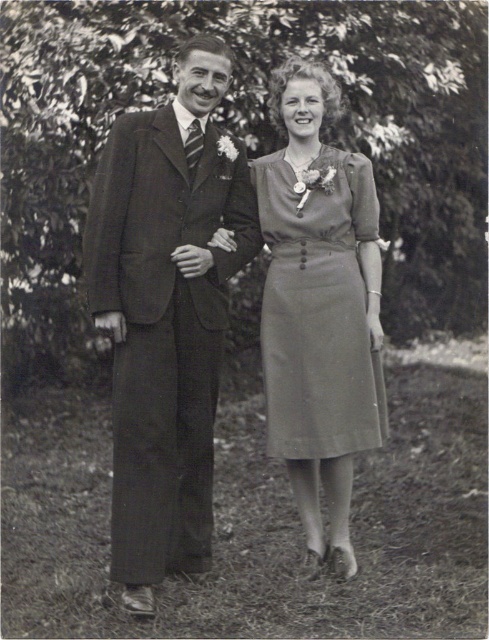
You are a photographer setting up for a group photo. You need to ensure that the matte dark suit at left and the matte gray dress at center are both in focus. Given that your camera has a depth of field that can cover 40 centimeters, will both subjects be in focus?

The distance between the matte dark suit at left and the matte gray dress at center is 42.23 centimeters. Since the camera can only cover 40 centimeters, the subjects are slightly out of the depth of field range. Therefore, both subjects may not be fully in focus.